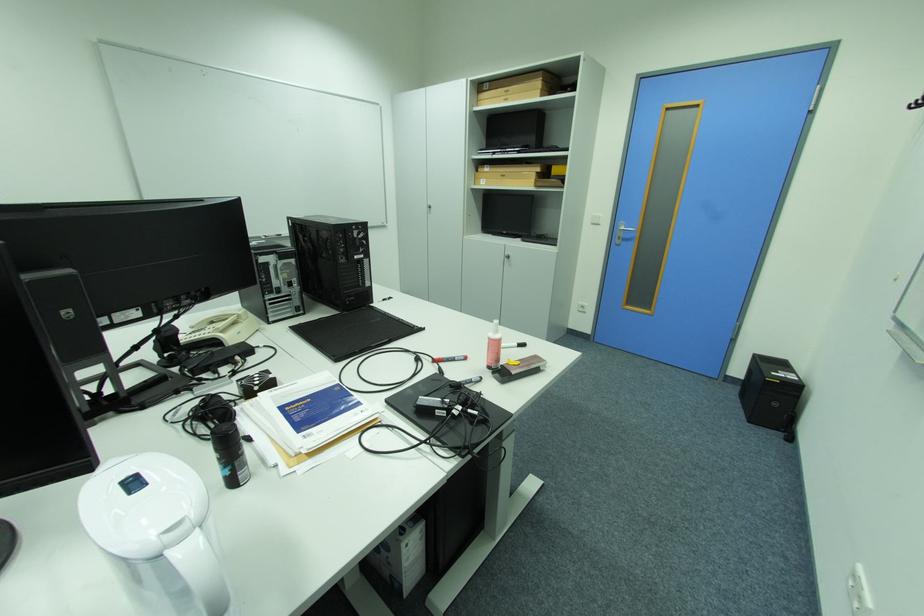
Where would you lift the white pitcher handle? Please return your answer as a coordinate pair (x, y).

(201, 573)